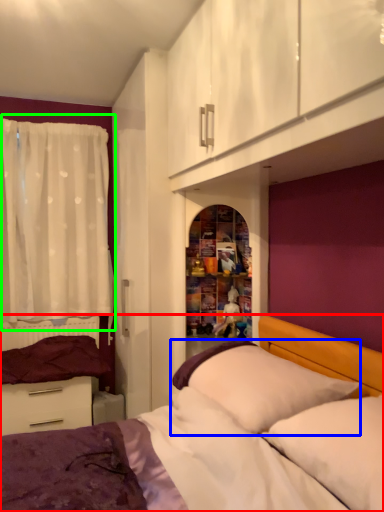
Question: Which is farther away from bed (highlighted by a red box)? pillow (highlighted by a blue box) or curtain (highlighted by a green box)?

Choices:
 (A) pillow
 (B) curtain

Answer: (B)